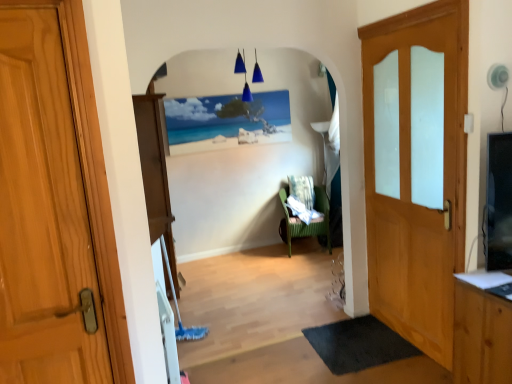
Question: Does wooden door with frosted glass panels at right, the 1th door in the right-to-left sequence, come behind wooden door at left, which is the second door in back-to-front order?

Choices:
 (A) yes
 (B) no

Answer: (A)

Question: From the image's perspective, is wooden door with frosted glass panels at right, placed as the second door when sorted from front to back, on wooden door at left, the 1th door in the left-to-right sequence?

Choices:
 (A) no
 (B) yes

Answer: (B)

Question: Is wooden door with frosted glass panels at right, the 1th door in the right-to-left sequence, oriented away from wooden door at left, placed as the first door when sorted from front to back?

Choices:
 (A) yes
 (B) no

Answer: (B)

Question: From a real-world perspective, is wooden door with frosted glass panels at right, placed as the second door when sorted from front to back, physically below wooden door at left, which is the second door in back-to-front order?

Choices:
 (A) no
 (B) yes

Answer: (B)

Question: Is wooden door with frosted glass panels at right, the 1th door in the right-to-left sequence, positioned beyond the bounds of wooden door at left, placed as the first door when sorted from front to back?

Choices:
 (A) yes
 (B) no

Answer: (A)

Question: From a real-world perspective, is black rubber mat at lower right positioned above or below green wicker chair at center?

Choices:
 (A) below
 (B) above

Answer: (A)

Question: In terms of height, does black rubber mat at lower right look taller or shorter compared to green wicker chair at center?

Choices:
 (A) tall
 (B) short

Answer: (B)

Question: Relative to green wicker chair at center, is black rubber mat at lower right in front or behind?

Choices:
 (A) behind
 (B) front

Answer: (B)

Question: Looking at the image, does black rubber mat at lower right seem bigger or smaller compared to green wicker chair at center?

Choices:
 (A) small
 (B) big

Answer: (A)

Question: Visually, is black rubber mat at lower right positioned to the left or to the right of wooden door with frosted glass panels at right, the 1th door in the right-to-left sequence?

Choices:
 (A) right
 (B) left

Answer: (B)

Question: From a real-world perspective, is black rubber mat at lower right positioned above or below wooden door with frosted glass panels at right, the 2th door positioned from the left?

Choices:
 (A) above
 (B) below

Answer: (B)

Question: Does point (334, 329) appear closer or farther from the camera than point (420, 322)?

Choices:
 (A) closer
 (B) farther

Answer: (B)

Question: Relative to wooden door with frosted glass panels at right, which appears as the 1th door when viewed from the back, is black rubber mat at lower right in front or behind?

Choices:
 (A) behind
 (B) front

Answer: (A)

Question: In terms of width, does wooden door at left, which is the second door in back-to-front order, look wider or thinner when compared to wooden door with frosted glass panels at right, placed as the second door when sorted from front to back?

Choices:
 (A) thin
 (B) wide

Answer: (B)

Question: Is wooden door at left, marked as the 2th door in a right-to-left arrangement, inside or outside of wooden door with frosted glass panels at right, which appears as the 1th door when viewed from the back?

Choices:
 (A) outside
 (B) inside

Answer: (A)